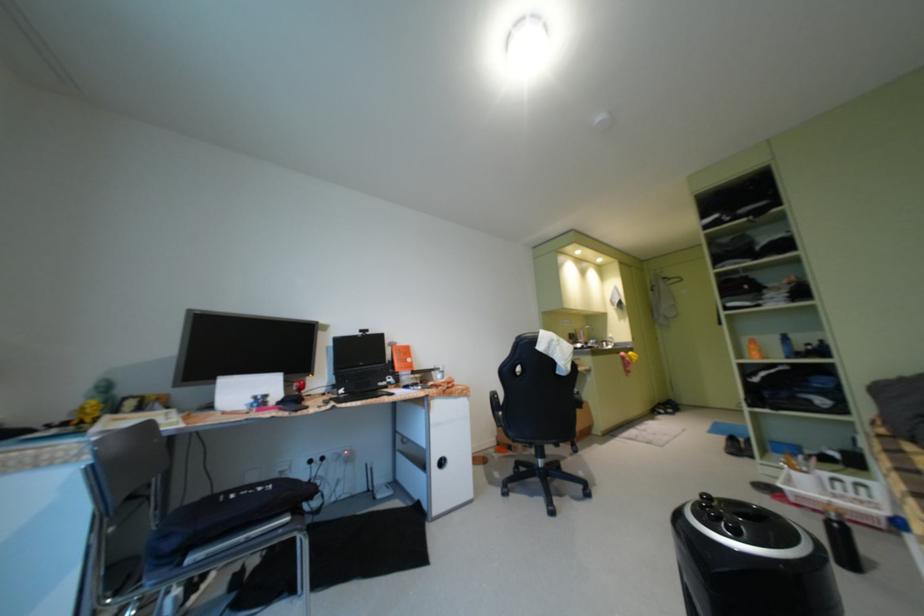
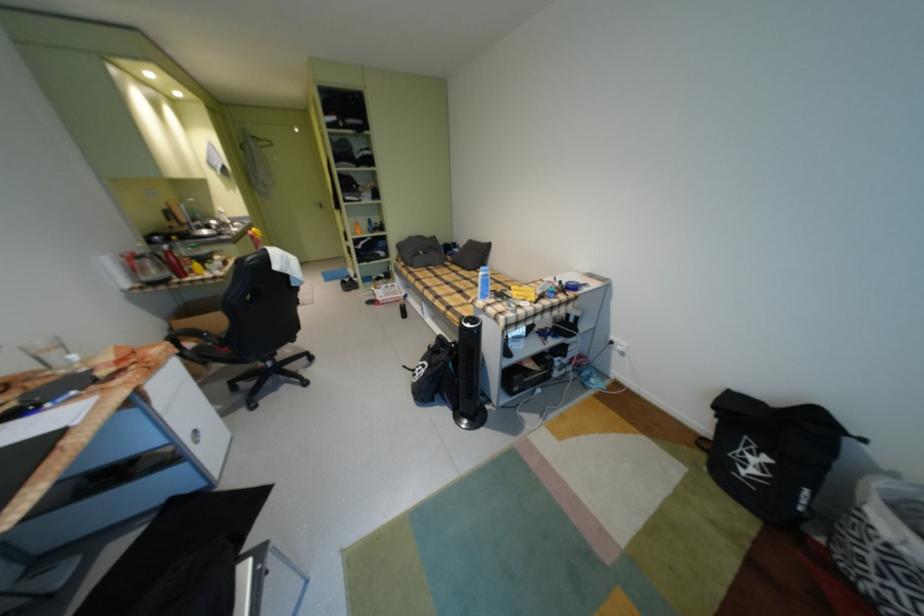
Locate, in the second image, the point that corresponds to the point at 551,349 in the first image.

(286, 268)